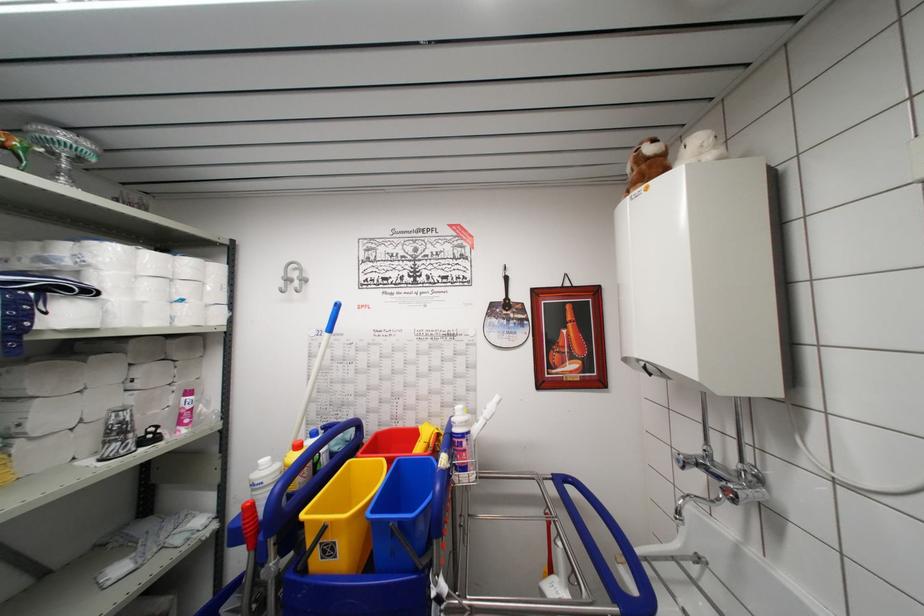
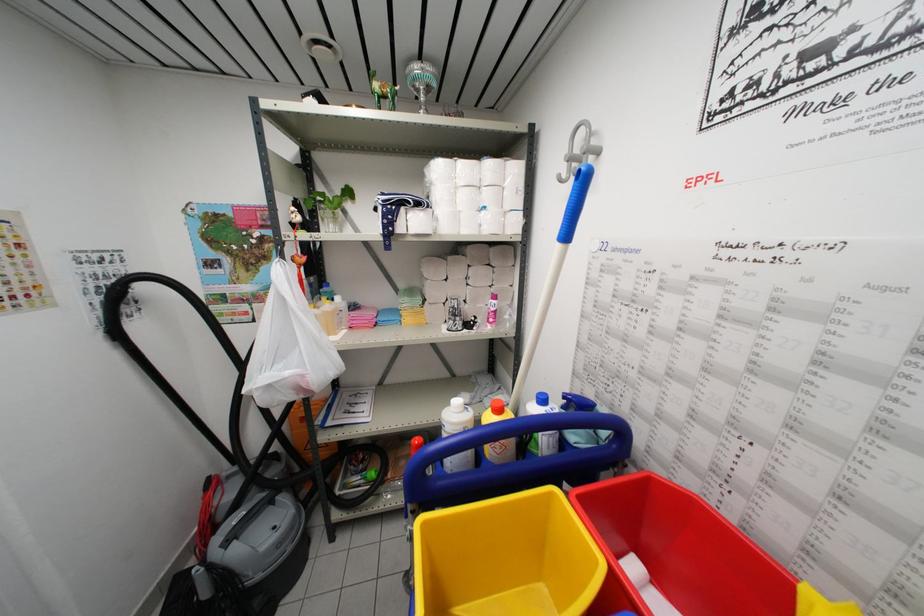
Where in the second image is the point corresponding to point (188, 294) from the first image?

(490, 201)